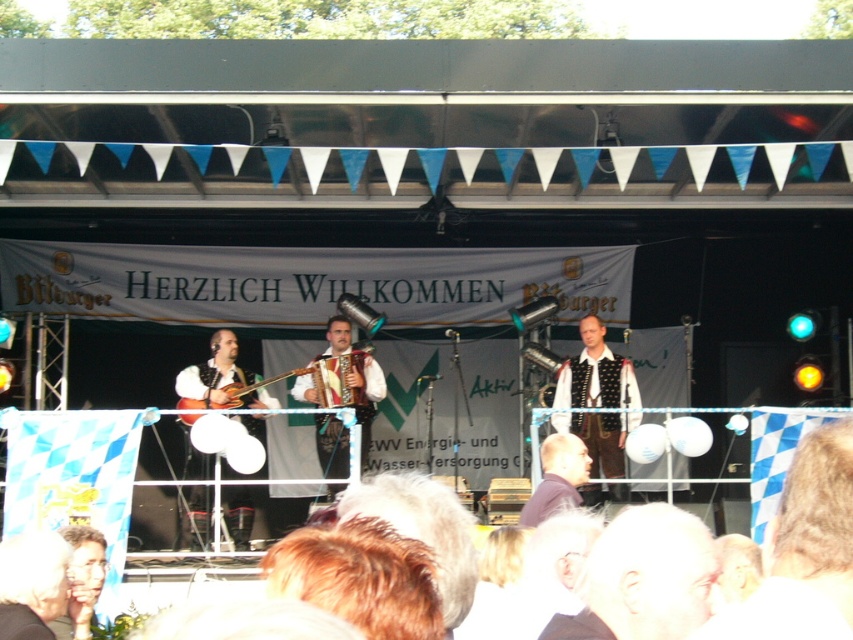
Who is more forward, [354,385] or [544,513]?

Point [544,513]

Is leather-like brown accordion at center taller than dark brown leather jacket at center?

Correct, leather-like brown accordion at center is much taller as dark brown leather jacket at center.

Between point (360, 420) and point (541, 520), which one is positioned behind?

Point (360, 420)

Identify the location of leather-like brown accordion at center. The image size is (853, 640). (331, 445).

Is point (550, 508) behind point (70, 630)?

Yes, it is behind point (70, 630).

What are the coordinates of `dark brown leather jacket at center` in the screenshot? It's located at (556, 477).

Between matte brown guitar at left and dark brown leather jacket at center, which one has less height?

With less height is dark brown leather jacket at center.

Who is taller, matte brown guitar at left or dark brown leather jacket at center?

With more height is matte brown guitar at left.

Does point (251, 378) come behind point (572, 500)?

Yes, it is.

Where is `matte brown guitar at left`? This screenshot has height=640, width=853. matte brown guitar at left is located at coordinates (213, 369).